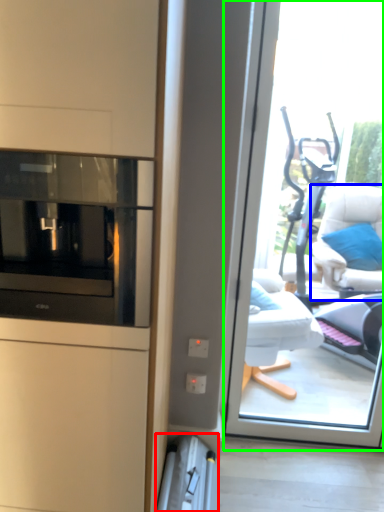
Question: Considering the real-world distances, which object is farthest from appliance (highlighted by a red box)? furniture (highlighted by a blue box) or window (highlighted by a green box)?

Choices:
 (A) furniture
 (B) window

Answer: (A)